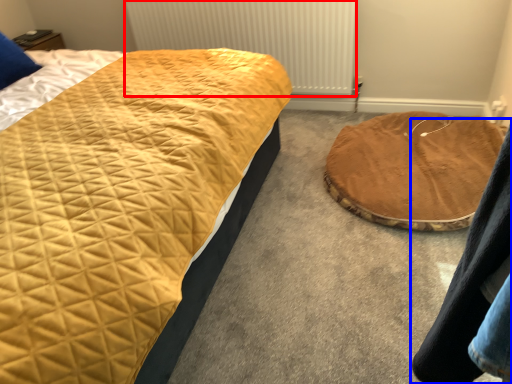
Question: Which object appears farthest to the camera in this image, radiator (highlighted by a red box) or couple (highlighted by a blue box)?

Choices:
 (A) radiator
 (B) couple

Answer: (A)